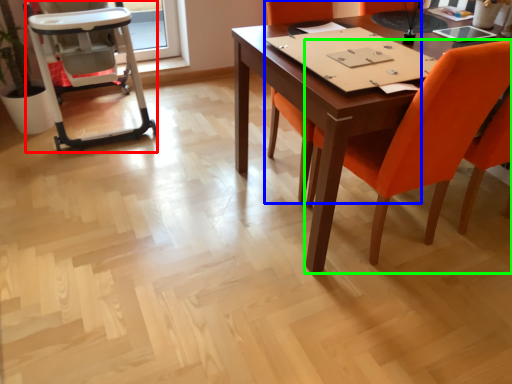
Question: Which object is the closest to the armchair (highlighted by a red box)? Choose among these: chair (highlighted by a blue box) or chair (highlighted by a green box).

Choices:
 (A) chair
 (B) chair

Answer: (A)